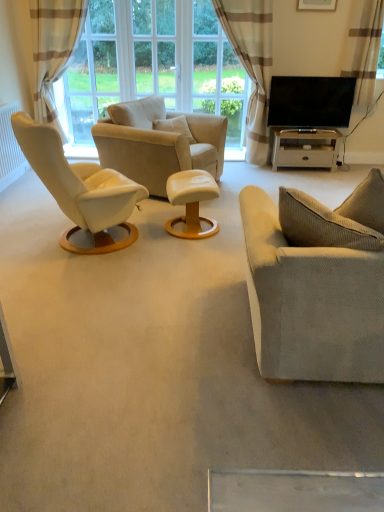
Question: Does transparent glass window at upper center, arranged as the third window screen when viewed from the right, have a lesser height compared to clear glass window at center, which ranks as the 1th window screen in right-to-left order?

Choices:
 (A) no
 (B) yes

Answer: (A)

Question: Considering the relative sizes of transparent glass window at upper center, arranged as the third window screen when viewed from the right, and clear glass window at center, placed as the 3th window screen when sorted from left to right, in the image provided, is transparent glass window at upper center, arranged as the third window screen when viewed from the right, thinner than clear glass window at center, placed as the 3th window screen when sorted from left to right,?

Choices:
 (A) no
 (B) yes

Answer: (A)

Question: Considering the relative sizes of transparent glass window at upper center, marked as the first window screen in a left-to-right arrangement, and clear glass window at center, which ranks as the 1th window screen in right-to-left order, in the image provided, is transparent glass window at upper center, marked as the first window screen in a left-to-right arrangement, smaller than clear glass window at center, which ranks as the 1th window screen in right-to-left order,?

Choices:
 (A) no
 (B) yes

Answer: (A)

Question: Does transparent glass window at upper center, marked as the first window screen in a left-to-right arrangement, have a greater width compared to clear glass window at center, which ranks as the 1th window screen in right-to-left order?

Choices:
 (A) no
 (B) yes

Answer: (B)

Question: From the image's perspective, is transparent glass window at upper center, arranged as the third window screen when viewed from the right, over clear glass window at center, which ranks as the 1th window screen in right-to-left order?

Choices:
 (A) no
 (B) yes

Answer: (B)

Question: Is transparent glass window at center, marked as the 2th window screen in a right-to-left arrangement, wider or thinner than white matte radiator at left?

Choices:
 (A) wide
 (B) thin

Answer: (B)

Question: In terms of height, does transparent glass window at center, the 2th window screen viewed from the left, look taller or shorter compared to white matte radiator at left?

Choices:
 (A) short
 (B) tall

Answer: (B)

Question: Considering the relative positions of transparent glass window at center, marked as the 2th window screen in a right-to-left arrangement, and white matte radiator at left in the image provided, is transparent glass window at center, marked as the 2th window screen in a right-to-left arrangement, to the left or to the right of white matte radiator at left?

Choices:
 (A) left
 (B) right

Answer: (B)

Question: Is point (160, 31) positioned closer to the camera than point (6, 136)?

Choices:
 (A) farther
 (B) closer

Answer: (A)

Question: Is matte white picture frame at upper center to the left or to the right of beige fabric armchair at center in the image?

Choices:
 (A) left
 (B) right

Answer: (B)

Question: Relative to beige fabric armchair at center, is matte white picture frame at upper center in front or behind?

Choices:
 (A) front
 (B) behind

Answer: (B)

Question: In terms of width, does matte white picture frame at upper center look wider or thinner when compared to beige fabric armchair at center?

Choices:
 (A) wide
 (B) thin

Answer: (B)

Question: Considering the positions of point (331, 8) and point (153, 96), is point (331, 8) closer or farther from the camera than point (153, 96)?

Choices:
 (A) closer
 (B) farther

Answer: (B)

Question: In terms of height, does white matte radiator at left look taller or shorter compared to brown textured curtain at upper right, marked as the third curtain in a left-to-right arrangement?

Choices:
 (A) short
 (B) tall

Answer: (A)

Question: From the image's perspective, relative to brown textured curtain at upper right, which is the first curtain in right-to-left order, is white matte radiator at left above or below?

Choices:
 (A) below
 (B) above

Answer: (A)